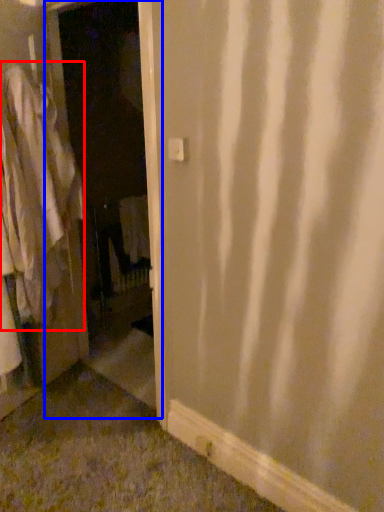
Question: Which point is closer to the camera, clothing (highlighted by a red box) or screen door (highlighted by a blue box)?

Choices:
 (A) clothing
 (B) screen door

Answer: (B)